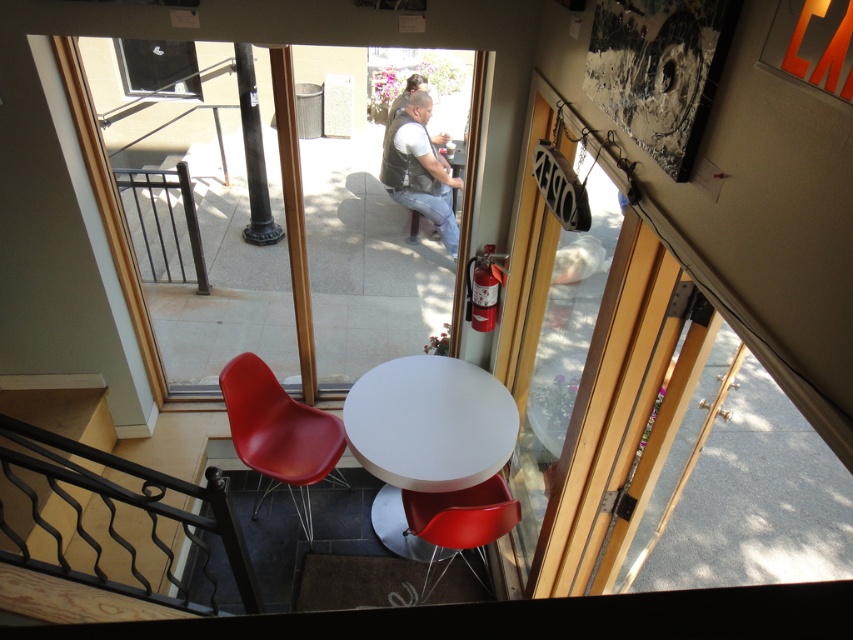
Is clear glass door at center positioned in front of matte plastic chair at lower center?

Yes, it is in front of matte plastic chair at lower center.

Who is shorter, clear glass door at center or matte plastic chair at lower center?

Standing shorter between the two is matte plastic chair at lower center.

Based on the photo, measure the distance between point (602, 234) and camera.

Point (602, 234) and camera are 2.31 meters apart from each other.

Locate an element on the screen. This screenshot has height=640, width=853. clear glass door at center is located at coordinates (554, 340).

This screenshot has width=853, height=640. Identify the location of clear glass door at center. (554, 340).

The height and width of the screenshot is (640, 853). What are the coordinates of `clear glass door at center` in the screenshot? It's located at (554, 340).

Is clear glass door at center shorter than white glossy table at center?

Incorrect, clear glass door at center's height does not fall short of white glossy table at center's.

Is point (607, 310) more distant than point (454, 480)?

No, (607, 310) is closer to viewer.

Does point (573, 288) lie behind point (350, 413)?

No, (573, 288) is closer to viewer.

The image size is (853, 640). I want to click on clear glass door at center, so click(x=554, y=340).